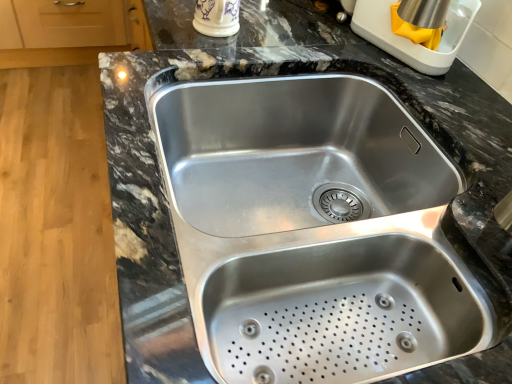
In order to click on stainless steel sink at center in this screenshot , I will do `click(314, 230)`.

The width and height of the screenshot is (512, 384). Identify the location of stainless steel kettle at upper right, which ranks as the first appliance in right-to-left order. (414, 29).

Does porcelain cup at upper center, the first appliance positioned from the left, appear on the left side of stainless steel sink at center?

Correct, you'll find porcelain cup at upper center, the first appliance positioned from the left, to the left of stainless steel sink at center.

Based on the photo, between porcelain cup at upper center, the 2th appliance viewed from the right, and stainless steel sink at center, which one is positioned in front?

Positioned in front is stainless steel sink at center.

What's the angular difference between porcelain cup at upper center, the first appliance positioned from the left, and stainless steel sink at center's facing directions?

The angle between the facing direction of porcelain cup at upper center, the first appliance positioned from the left, and the facing direction of stainless steel sink at center is 0.00021 degrees.

From the image's perspective, is porcelain cup at upper center, the first appliance positioned from the left, above or below stainless steel sink at center?

From the image's perspective, porcelain cup at upper center, the first appliance positioned from the left, appears above stainless steel sink at center.

Would you say stainless steel sink at center is to the left or to the right of stainless steel kettle at upper right, the second appliance when ordered from left to right, in the picture?

Clearly, stainless steel sink at center is on the left of stainless steel kettle at upper right, the second appliance when ordered from left to right, in the image.

From a real-world perspective, which is physically above, stainless steel sink at center or stainless steel kettle at upper right, which ranks as the first appliance in right-to-left order?

In real-world perspective, stainless steel kettle at upper right, which ranks as the first appliance in right-to-left order, is above.

Are stainless steel sink at center and stainless steel kettle at upper right, which ranks as the first appliance in right-to-left order, beside each other?

stainless steel sink at center and stainless steel kettle at upper right, which ranks as the first appliance in right-to-left order, are not in contact.

Is stainless steel kettle at upper right, the second appliance when ordered from left to right, in contact with porcelain cup at upper center, the 2th appliance viewed from the right?

No, stainless steel kettle at upper right, the second appliance when ordered from left to right, is not beside porcelain cup at upper center, the 2th appliance viewed from the right.

Locate an element on the screen. The width and height of the screenshot is (512, 384). appliance lying behind the stainless steel kettle at upper right, the second appliance when ordered from left to right is located at coordinates (217, 17).

Is porcelain cup at upper center, the first appliance positioned from the left, inside stainless steel kettle at upper right, which ranks as the first appliance in right-to-left order?

No, porcelain cup at upper center, the first appliance positioned from the left, is not inside stainless steel kettle at upper right, which ranks as the first appliance in right-to-left order.

Considering the relative positions of stainless steel kettle at upper right, which ranks as the first appliance in right-to-left order, and porcelain cup at upper center, the first appliance positioned from the left, in the image provided, is stainless steel kettle at upper right, which ranks as the first appliance in right-to-left order, to the left of porcelain cup at upper center, the first appliance positioned from the left, from the viewer's perspective?

In fact, stainless steel kettle at upper right, which ranks as the first appliance in right-to-left order, is to the right of porcelain cup at upper center, the first appliance positioned from the left.

Is stainless steel sink at center in front of or behind porcelain cup at upper center, the 2th appliance viewed from the right, in the image?

Clearly, stainless steel sink at center is in front of porcelain cup at upper center, the 2th appliance viewed from the right.

Considering the points (266, 336) and (220, 17), which point is in front, point (266, 336) or point (220, 17)?

Positioned in front is point (266, 336).

Would you say stainless steel sink at center is a long distance from porcelain cup at upper center, the 2th appliance viewed from the right?

No.

From a real-world perspective, which object stands above the other?

porcelain cup at upper center, the first appliance positioned from the left, is physically above.

Is stainless steel kettle at upper right, the second appliance when ordered from left to right, far from stainless steel sink at center?

Actually, stainless steel kettle at upper right, the second appliance when ordered from left to right, and stainless steel sink at center are a little close together.

From the image's perspective, who appears lower, stainless steel kettle at upper right, the second appliance when ordered from left to right, or stainless steel sink at center?

stainless steel sink at center, from the image's perspective.

Is stainless steel kettle at upper right, the second appliance when ordered from left to right, oriented towards stainless steel sink at center?

No, stainless steel kettle at upper right, the second appliance when ordered from left to right, does not turn towards stainless steel sink at center.

Considering the relative positions of porcelain cup at upper center, the 2th appliance viewed from the right, and stainless steel kettle at upper right, the second appliance when ordered from left to right, in the image provided, is porcelain cup at upper center, the 2th appliance viewed from the right, behind stainless steel kettle at upper right, the second appliance when ordered from left to right,?

Yes, the depth of porcelain cup at upper center, the 2th appliance viewed from the right, is greater than that of stainless steel kettle at upper right, the second appliance when ordered from left to right.

From a real-world perspective, is porcelain cup at upper center, the 2th appliance viewed from the right, physically located above or below stainless steel kettle at upper right, which ranks as the first appliance in right-to-left order?

porcelain cup at upper center, the 2th appliance viewed from the right, is below stainless steel kettle at upper right, which ranks as the first appliance in right-to-left order.

Can you confirm if porcelain cup at upper center, the 2th appliance viewed from the right, is wider than stainless steel kettle at upper right, the second appliance when ordered from left to right?

Incorrect, the width of porcelain cup at upper center, the 2th appliance viewed from the right, does not surpass that of stainless steel kettle at upper right, the second appliance when ordered from left to right.

From the image's perspective, is porcelain cup at upper center, the first appliance positioned from the left, below stainless steel kettle at upper right, the second appliance when ordered from left to right?

No.

From a real-world perspective, which appliance is the 1st one above the stainless steel sink at center? Please provide its 2D coordinates.

[(217, 17)]

This screenshot has height=384, width=512. I want to click on sink below the stainless steel kettle at upper right, the second appliance when ordered from left to right (from a real-world perspective), so click(x=314, y=230).

Considering their positions, is stainless steel sink at center positioned further to porcelain cup at upper center, the 2th appliance viewed from the right, than stainless steel kettle at upper right, the second appliance when ordered from left to right?

stainless steel sink at center is positioned further to the anchor porcelain cup at upper center, the 2th appliance viewed from the right.

When comparing their distances from stainless steel sink at center, does stainless steel kettle at upper right, which ranks as the first appliance in right-to-left order, or porcelain cup at upper center, the first appliance positioned from the left, seem closer?

stainless steel kettle at upper right, which ranks as the first appliance in right-to-left order, lies closer to stainless steel sink at center than the other object.

From the image, which object appears to be farther from stainless steel sink at center, porcelain cup at upper center, the first appliance positioned from the left, or stainless steel kettle at upper right, the second appliance when ordered from left to right?

Based on the image, porcelain cup at upper center, the first appliance positioned from the left, appears to be further to stainless steel sink at center.

From the image, which object appears to be farther from stainless steel kettle at upper right, which ranks as the first appliance in right-to-left order, porcelain cup at upper center, the 2th appliance viewed from the right, or stainless steel sink at center?

stainless steel sink at center.

In the scene shown: Looking at the image, which one is located further to porcelain cup at upper center, the first appliance positioned from the left, stainless steel kettle at upper right, the second appliance when ordered from left to right, or stainless steel sink at center?

The object further to porcelain cup at upper center, the first appliance positioned from the left, is stainless steel sink at center.

When comparing their distances from stainless steel kettle at upper right, which ranks as the first appliance in right-to-left order, does stainless steel sink at center or porcelain cup at upper center, the 2th appliance viewed from the right, seem further?

The object further to stainless steel kettle at upper right, which ranks as the first appliance in right-to-left order, is stainless steel sink at center.

Locate an element on the screen. This screenshot has width=512, height=384. appliance between porcelain cup at upper center, the 2th appliance viewed from the right, and stainless steel sink at center in the up-down direction is located at coordinates (414, 29).